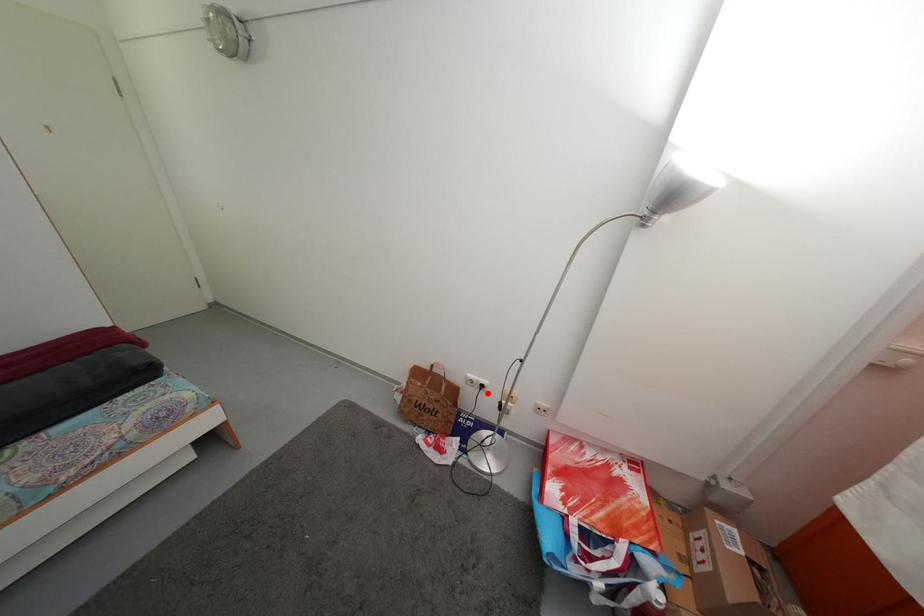
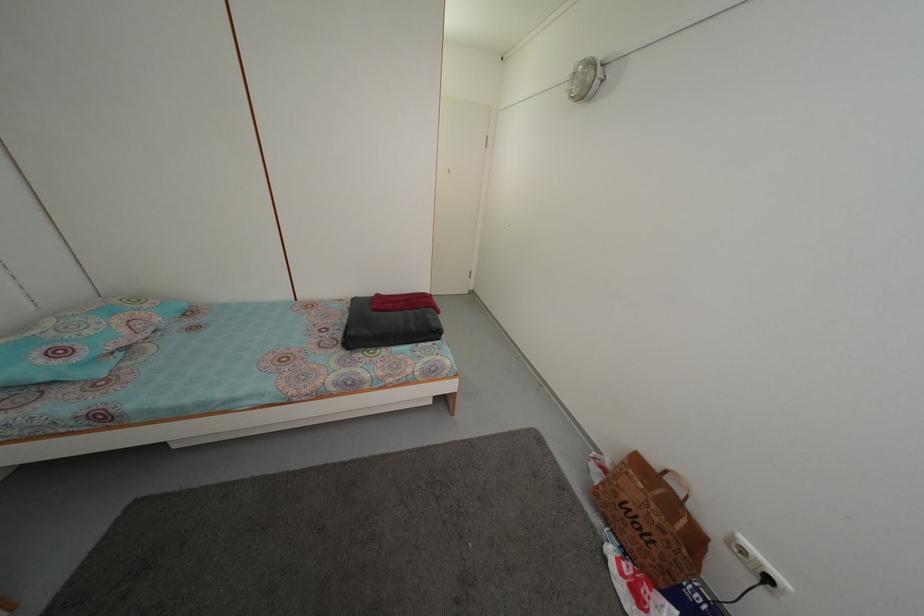
Where in the second image is the point corresponding to the highlighted location from the first image?

(774, 588)